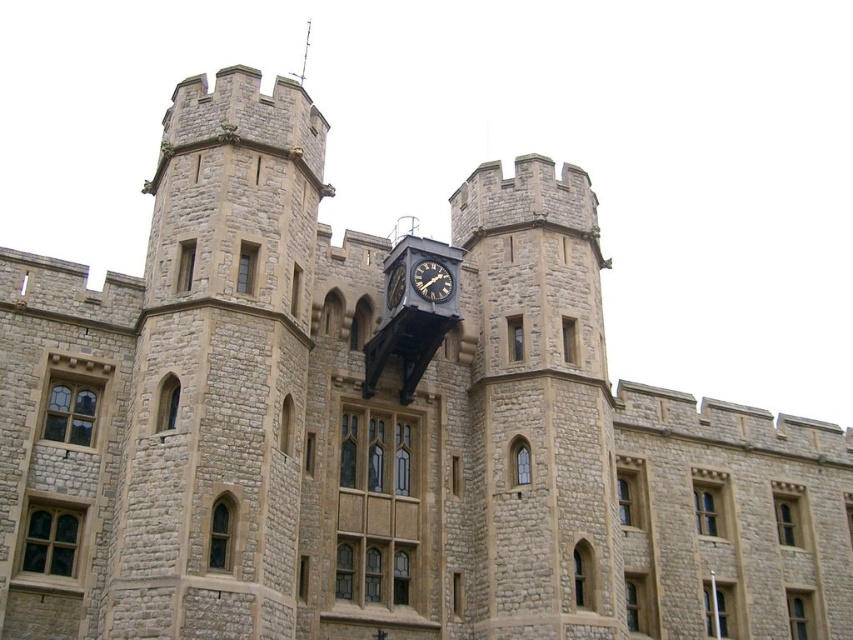
As you stand in front of the historic stone building, you notice a point marked at coordinates (432, 280). Can you identify which object is precisely at that location?

The black metal clock at center is located at point (432, 280).

You are an architect examining the historic stone building. You notice two points marked on the facade. The first point is at coordinates point (440,273) and the second is at point (387,307). Based on the building structure, which point is closer to the observer?

Point (440,273) is in front of point (387,307), so it is closer to the observer.